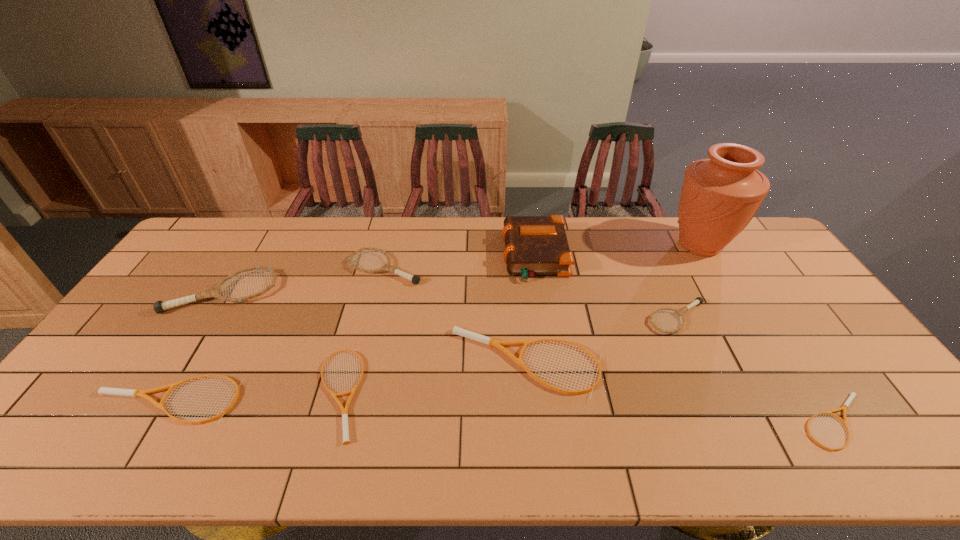
In order to click on free space located on the spine side of the second tallest object in this screenshot , I will do `click(444, 255)`.

This screenshot has height=540, width=960. I want to click on free space located 0.050m on the front of the biggest gray tennis racket, so click(201, 329).

You are a GUI agent. You are given a task and a screenshot of the screen. Output one action in this format:
    pyautogui.click(x=<x>, y=<y>)
    Task: Click on the free region located on the front of the second gray tennis racket from left to right
    The width and height of the screenshot is (960, 540).
    Given the screenshot: What is the action you would take?
    pyautogui.click(x=363, y=358)

Identify the location of free space located 0.280m on the right of the sixth tennis racket from left to right. This screenshot has width=960, height=540. (804, 318).

Locate an element on the screen. vacant area situated on the back of the biggest beige tennis racket is located at coordinates (518, 270).

Locate an element on the screen. This screenshot has height=540, width=960. free space located on the back of the seventh tallest object is located at coordinates (228, 298).

Locate an element on the screen. This screenshot has height=540, width=960. vacant space located 0.370m on the back of the sixth tallest tennis racket is located at coordinates (372, 263).

Identify the location of free region located 0.220m on the left of the rightmost tennis racket. Image resolution: width=960 pixels, height=540 pixels. (704, 423).

Where is `vase present at the far edge`? The height and width of the screenshot is (540, 960). vase present at the far edge is located at coordinates (720, 195).

The image size is (960, 540). I want to click on Bible present at the far edge, so click(534, 245).